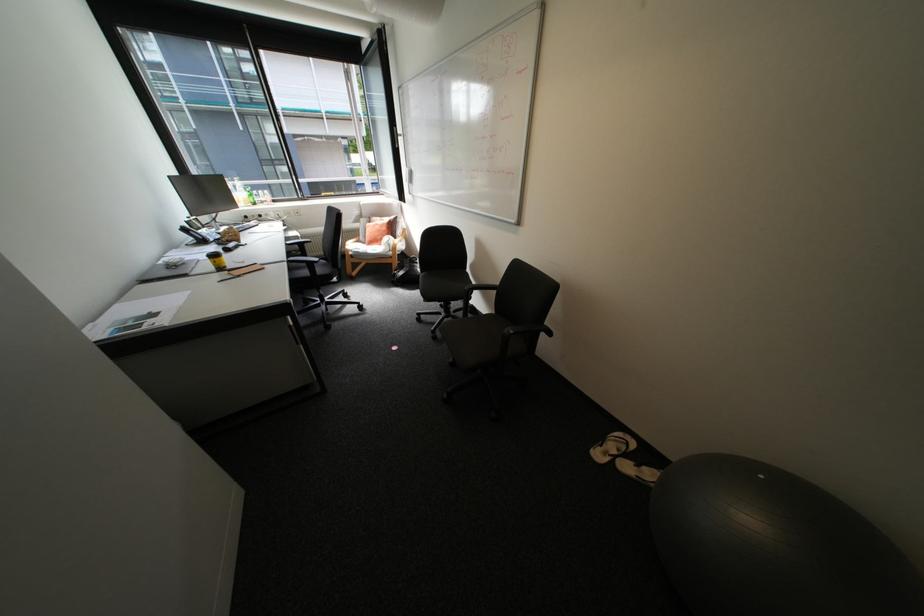
This screenshot has height=616, width=924. What are the coordinates of `telephone handset` in the screenshot? It's located at (191, 233).